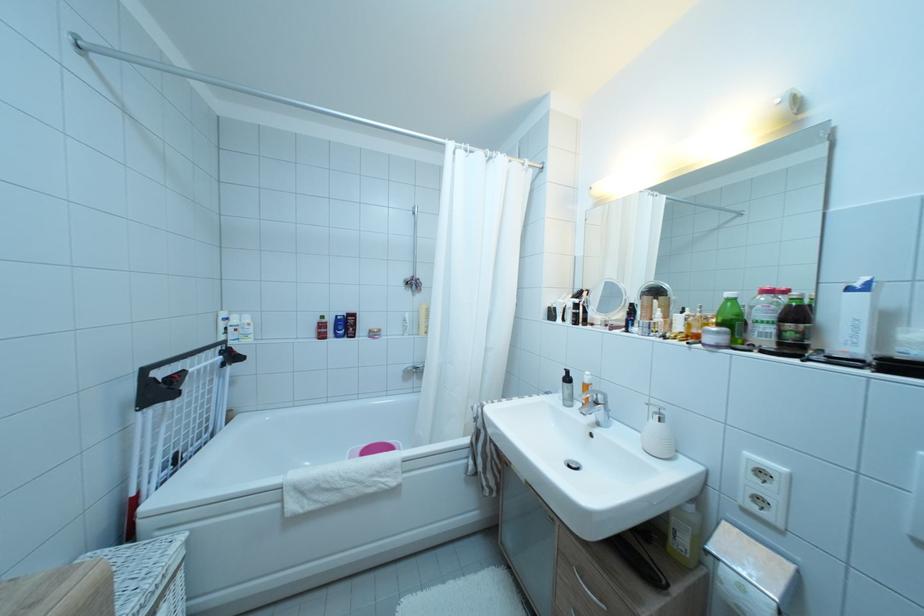
This screenshot has height=616, width=924. What do you see at coordinates (586, 387) in the screenshot? I see `a orange bottle pump` at bounding box center [586, 387].